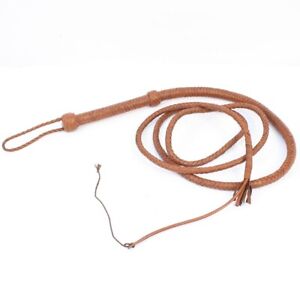
Image resolution: width=300 pixels, height=300 pixels. Identify the location of handle. (138, 99).